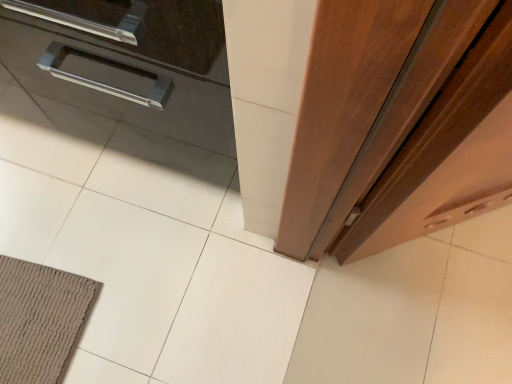
Image resolution: width=512 pixels, height=384 pixels. What do you see at coordinates (130, 65) in the screenshot?
I see `glossy black drawer at upper left` at bounding box center [130, 65].

Locate an element on the screen. glossy black drawer at upper left is located at coordinates (130, 65).

What is the approximate height of glossy black drawer at upper left?

25.09 inches.

At what (x,y) coordinates should I click in order to perform the action: click on glossy black drawer at upper left. Please return your answer as a coordinate pair (x, y). This screenshot has width=512, height=384. Looking at the image, I should click on (130, 65).